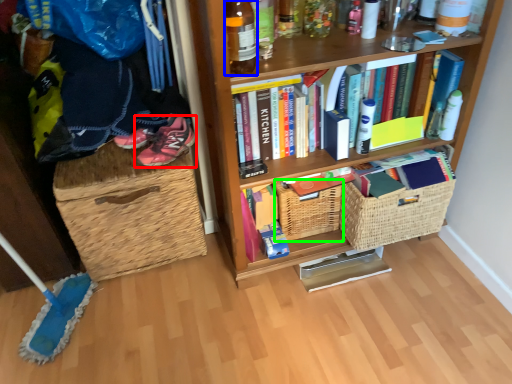
Question: Based on their relative distances, which object is nearer to footwear (highlighted by a red box)? Choose from bottle (highlighted by a blue box) and basket (highlighted by a green box).

Choices:
 (A) bottle
 (B) basket

Answer: (B)